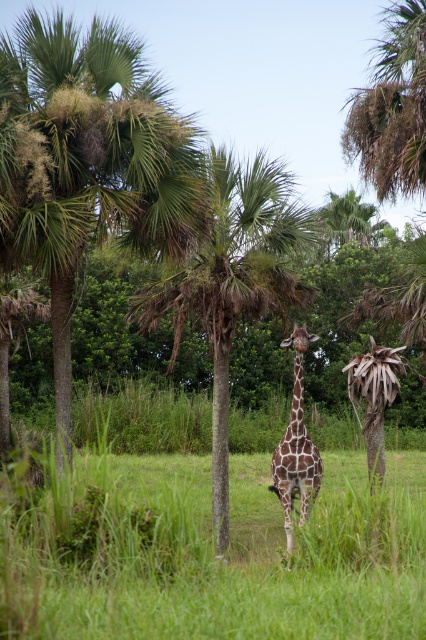
Which is in front, point (284, 301) or point (299, 349)?

Point (299, 349) is in front.

Does green leafy palm tree at center have a lesser height compared to spotted fur giraffe at center?

No, green leafy palm tree at center is not shorter than spotted fur giraffe at center.

Is point (236, 323) more distant than point (282, 509)?

No.

This screenshot has width=426, height=640. Find the location of `green leafy palm tree at center`. green leafy palm tree at center is located at coordinates (233, 280).

Who is higher up, green leafy palm tree at left or green leafy palm tree at center?

green leafy palm tree at left is higher up.

Is green leafy palm tree at left above green leafy palm tree at center?

Correct, green leafy palm tree at left is located above green leafy palm tree at center.

Is point (9, 138) positioned before point (259, 278)?

Yes, point (9, 138) is closer to viewer.

Find the location of `green leafy palm tree at left`. green leafy palm tree at left is located at coordinates (86, 163).

Who is lower down, green leafy palm tree at left or spotted fur giraffe at center?

spotted fur giraffe at center

Does green leafy palm tree at left appear over spotted fur giraffe at center?

Yes.

Is point (80, 141) positioned before point (317, 464)?

That is True.

This screenshot has height=640, width=426. I want to click on green leafy palm tree at left, so click(x=86, y=163).